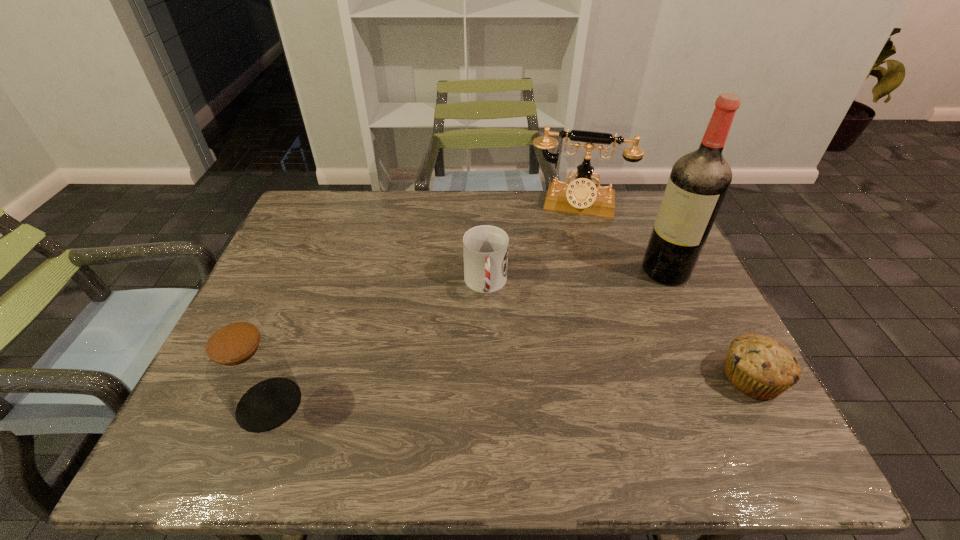
Where is `jar that is at the near edge`? The height and width of the screenshot is (540, 960). jar that is at the near edge is located at coordinates (248, 370).

Find the location of a particular element. muffin that is at the near edge is located at coordinates (761, 367).

Identify the location of object at the left edge. (248, 370).

This screenshot has width=960, height=540. What are the coordinates of `muffin located at the right edge` in the screenshot? It's located at tap(761, 367).

You are a GUI agent. You are given a task and a screenshot of the screen. Output one action in this format:
    pyautogui.click(x=<x>, y=<y>)
    Task: Click on the liquor at the right edge
    The height and width of the screenshot is (540, 960).
    Given the screenshot: What is the action you would take?
    pyautogui.click(x=698, y=183)

Where is `telephone situated at the right edge`? telephone situated at the right edge is located at coordinates (581, 196).

This screenshot has width=960, height=540. Find the location of `object located in the near left corner section of the desktop`. object located in the near left corner section of the desktop is located at coordinates (248, 370).

Find the location of `object present at the far right corner`. object present at the far right corner is located at coordinates tap(581, 196).

You are a GUI agent. You are given a task and a screenshot of the screen. Output one action in this format:
    pyautogui.click(x=<x>, y=<y>)
    Task: Click on the object that is at the near right corner
    
    Given the screenshot: What is the action you would take?
    pos(761,367)

Identify the location of vacant region at the far edge of the desktop. This screenshot has height=540, width=960. pyautogui.click(x=512, y=218).